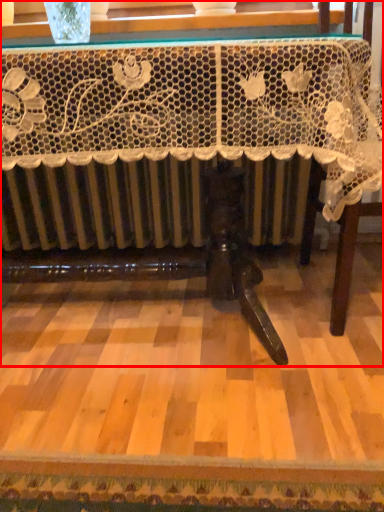
Question: From the image's perspective, what is the correct spatial relationship of table (annotated by the red box) in relation to furniture?

Choices:
 (A) above
 (B) below

Answer: (B)